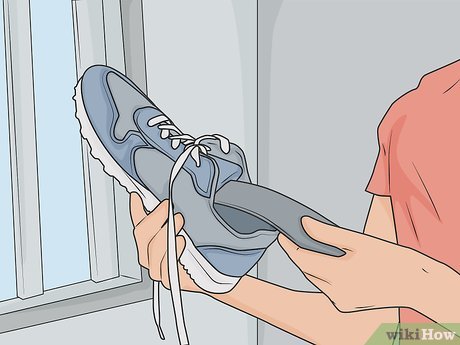
Identify the location of wall. The width and height of the screenshot is (460, 345). (199, 107).